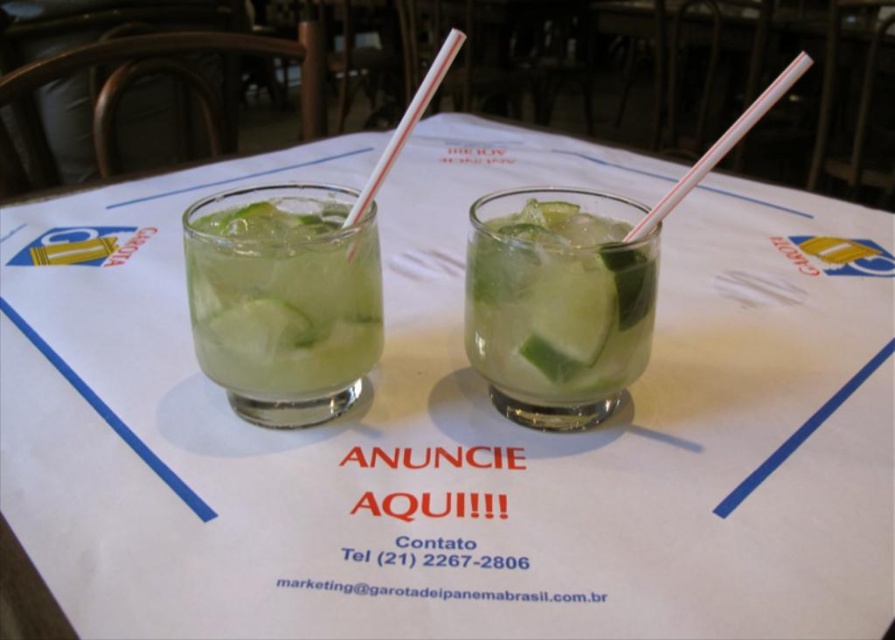
You are a photographer trying to capture a closeup of the lime slices in the mojito glasses. You notice two points of interest marked as point 1 at coordinates point (616, 292) and point 2 at coordinates point (424, 93). Which point should you focus on to ensure the lime slices are in sharp focus?

You should focus on point 1 at coordinates point (616, 292) because it is closer to the camera than point 2 at coordinates point (424, 93), ensuring the lime slices will be in sharp focus.

You are at a cafe and want to drink your mojito without spilling. The green translucent glass at center has a white striped plastic straw at center. Which object should you hold to steady the glass?

You should hold the green translucent glass at center to steady it, since the white striped plastic straw at center is longer than the glass and may not provide stability.